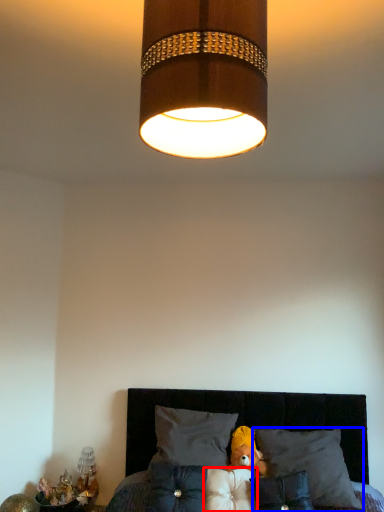
Question: Which object appears closest to the camera in this image, pillow (highlighted by a red box) or pillow (highlighted by a blue box)?

Choices:
 (A) pillow
 (B) pillow

Answer: (A)